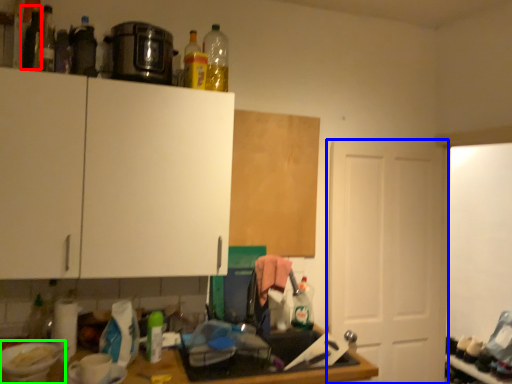
Question: Which is farther away from bottle (highlighted by a red box)? door (highlighted by a blue box) or appliance (highlighted by a green box)?

Choices:
 (A) door
 (B) appliance

Answer: (A)